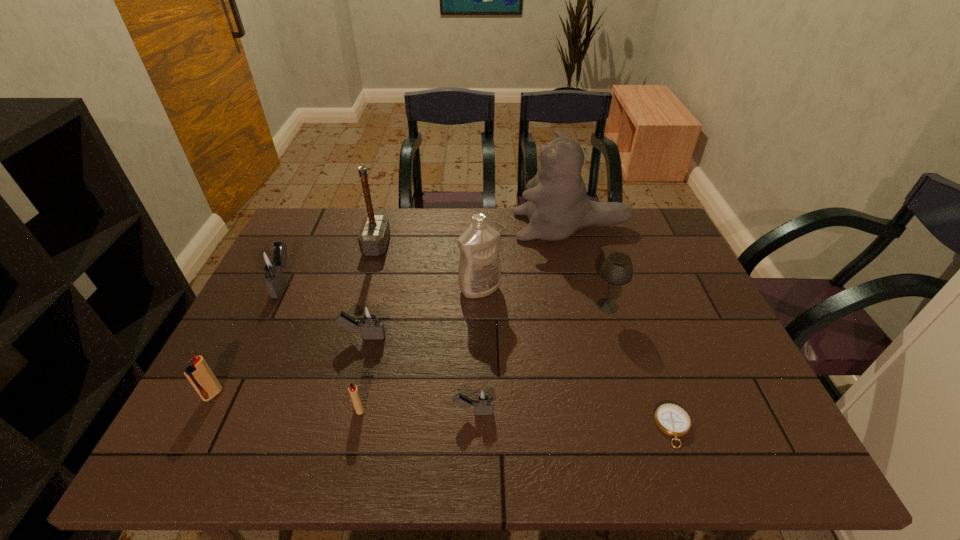
I want to click on free space located on the back of the gray wineglass, so click(x=588, y=237).

This screenshot has height=540, width=960. Identify the location of vacant point located 0.290m on the back of the biggest gray igniter. pos(318,212).

Where is `vacant position located on the back of the sixth farthest object`? The image size is (960, 540). vacant position located on the back of the sixth farthest object is located at coordinates (389, 235).

Locate an element on the screen. vacant space located 0.370m on the back of the third farthest igniter is located at coordinates pyautogui.click(x=273, y=279).

You are a GUI agent. You are given a task and a screenshot of the screen. Output one action in this format:
    pyautogui.click(x=<x>, y=<y>)
    Task: Click on the vacant space located 0.280m on the left of the right red igniter
    The image size is (960, 540).
    Given the screenshot: What is the action you would take?
    pyautogui.click(x=227, y=409)

Where is `blank area located on the back of the nearest gray igniter`? blank area located on the back of the nearest gray igniter is located at coordinates (474, 380).

Identify the location of vacant space situated 0.310m on the left of the shortest object. This screenshot has width=960, height=540. (511, 427).

Identify the location of cat positioned at the far edge. click(x=558, y=206).

Where is `hammer situated at the far edge`? hammer situated at the far edge is located at coordinates (373, 237).

This screenshot has height=540, width=960. I want to click on object that is at the near edge, so click(x=671, y=419).